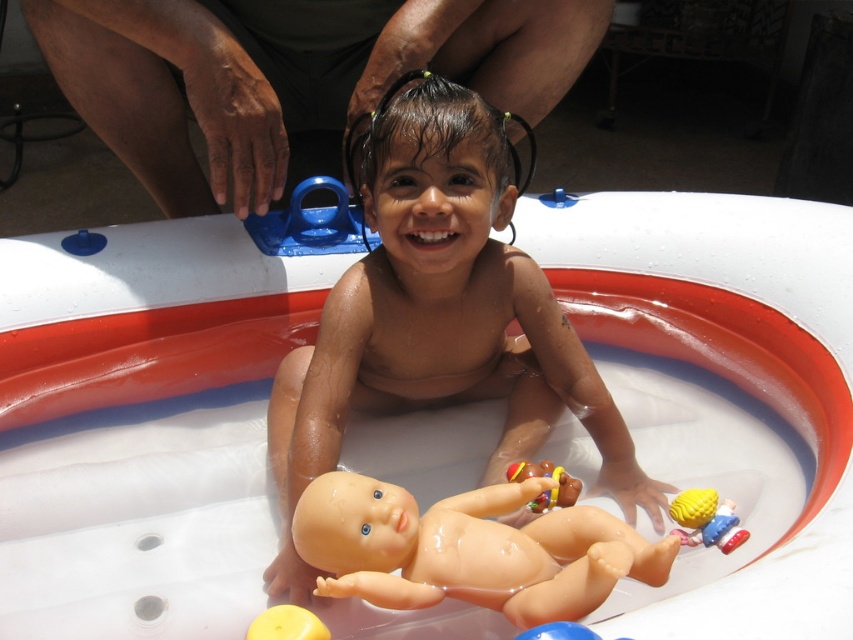
Question: Which is farther from the smooth tan skin at center?

Choices:
 (A) yellow rubber toy at lower right
 (B) white rubber bath at center
 (C) rubber baby doll at center
 (D) brown skin at upper center

Answer: (A)

Question: Which object appears closest to the camera in this image?

Choices:
 (A) brown skin at upper center
 (B) yellow rubber toy at lower right
 (C) white rubber bath at center
 (D) yellow rubber ball at lower center

Answer: (C)

Question: Is white rubber bath at center behind brown skin at upper center?

Choices:
 (A) no
 (B) yes

Answer: (A)

Question: Considering the relative positions of white rubber bath at center and rubber baby doll at center in the image provided, where is white rubber bath at center located with respect to rubber baby doll at center?

Choices:
 (A) right
 (B) left

Answer: (A)

Question: Which of these objects is positioned farthest from the rubber baby doll at center?

Choices:
 (A) yellow rubber ball at lower center
 (B) white rubber bath at center
 (C) brown skin at upper center
 (D) yellow rubber toy at lower right

Answer: (C)

Question: From the image, what is the correct spatial relationship of brown skin at upper center in relation to yellow rubber toy at lower right?

Choices:
 (A) left
 (B) right

Answer: (A)